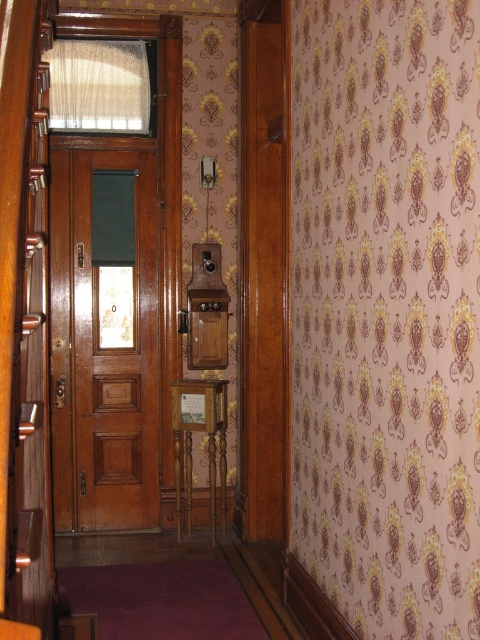
Does wooden door at center have a lesser width compared to silky beige curtain at upper center?

Yes, wooden door at center is thinner than silky beige curtain at upper center.

The image size is (480, 640). What do you see at coordinates (115, 339) in the screenshot? I see `wooden door at center` at bounding box center [115, 339].

This screenshot has height=640, width=480. Identify the location of wooden door at center. (115, 339).